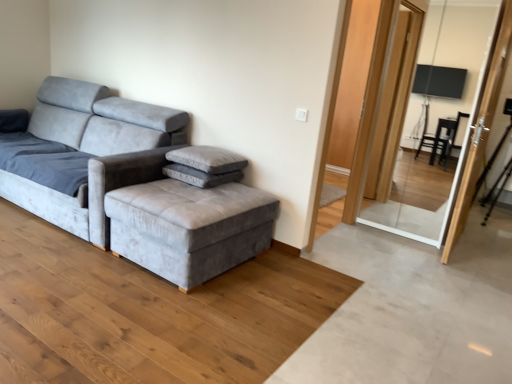
This screenshot has width=512, height=384. What are the coordinates of `free space in front of matte black screen door at upper right, the 1th screen door viewed from the right` in the screenshot? It's located at (471, 271).